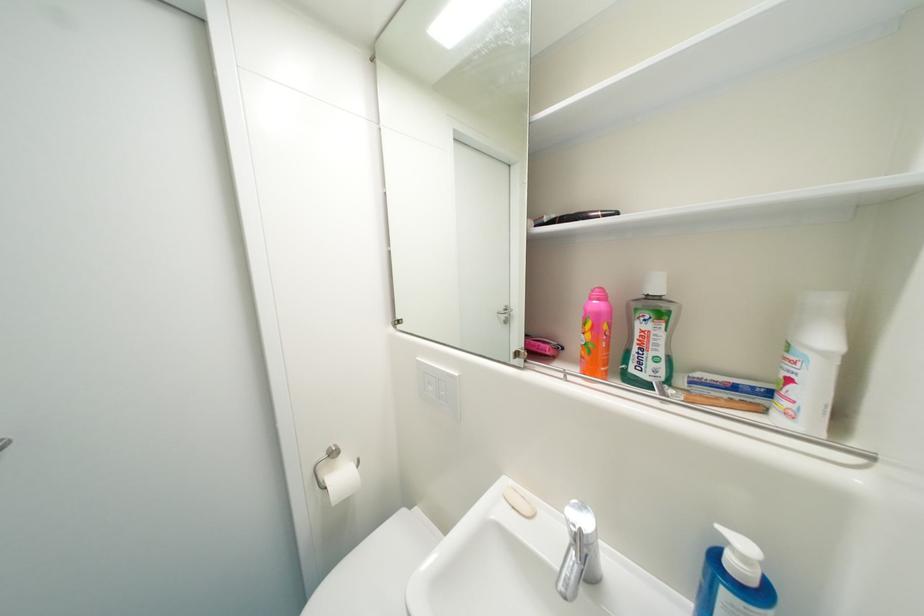
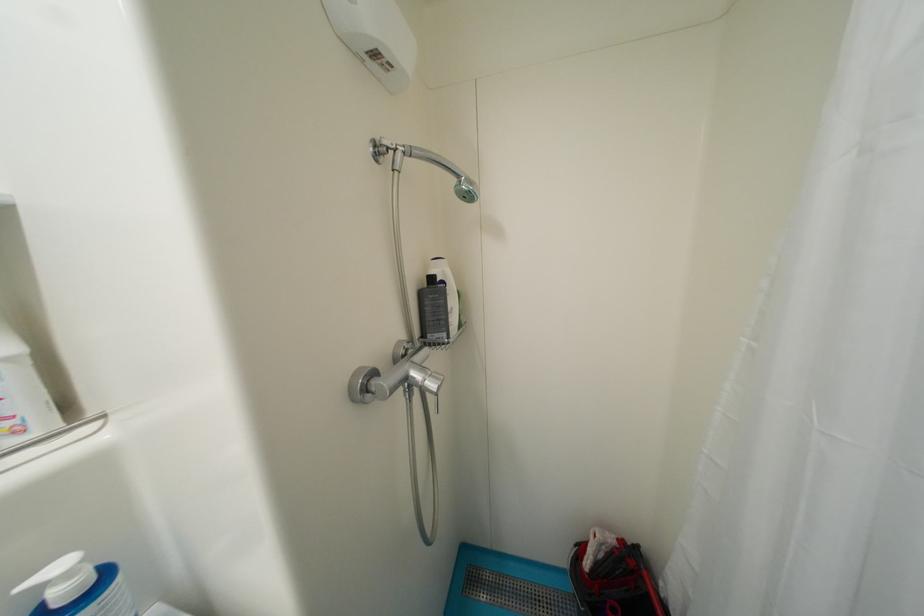
In the second image, find the point that corresponds to [750,560] in the first image.

(75, 576)